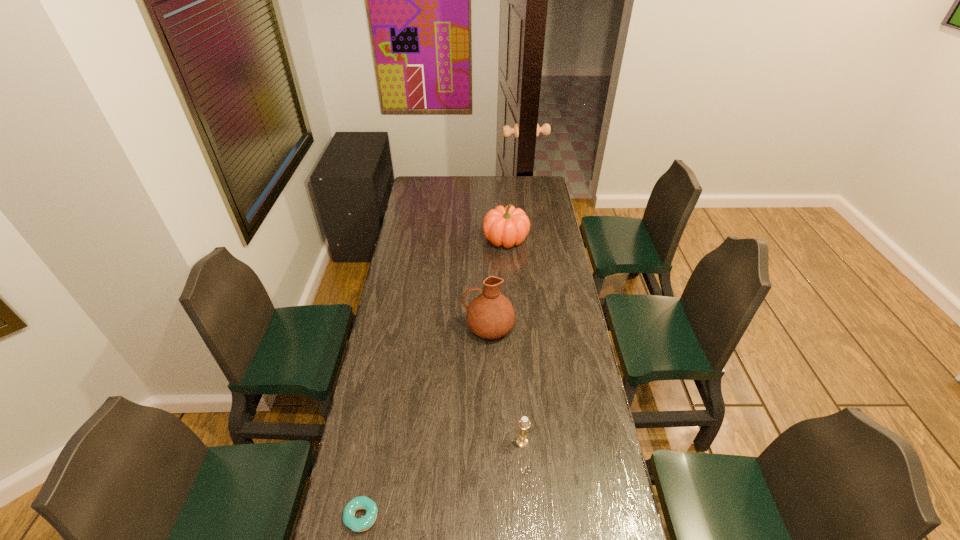
This screenshot has width=960, height=540. Find the location of `vacant region located on the side of the tallest object with the handle`. vacant region located on the side of the tallest object with the handle is located at coordinates (451, 327).

The height and width of the screenshot is (540, 960). I want to click on vacant position located on the back of the farthest object, so click(503, 200).

Locate an element on the screen. This screenshot has width=960, height=540. vacant space located on the back of the third tallest object is located at coordinates (516, 348).

The height and width of the screenshot is (540, 960). Identify the location of vacant space positioned on the back of the doughnut. (376, 438).

Identify the location of object located in the left edge section of the desktop. (362, 524).

In order to click on object at the right edge in this screenshot , I will do `click(508, 226)`.

The height and width of the screenshot is (540, 960). In the image, there is a desktop. Identify the location of vacant space at the left edge. (429, 225).

This screenshot has width=960, height=540. I want to click on vacant area at the right edge of the desktop, so click(x=525, y=211).

Where is `free region at the far right corner of the desktop`? This screenshot has height=540, width=960. free region at the far right corner of the desktop is located at coordinates point(545,196).

You are a GUI agent. You are given a task and a screenshot of the screen. Output one action in this format:
    pyautogui.click(x=<x>, y=<y>)
    Task: Click on the unoccupied position between the shortest object and the pumpkin
    
    Given the screenshot: What is the action you would take?
    pyautogui.click(x=434, y=377)